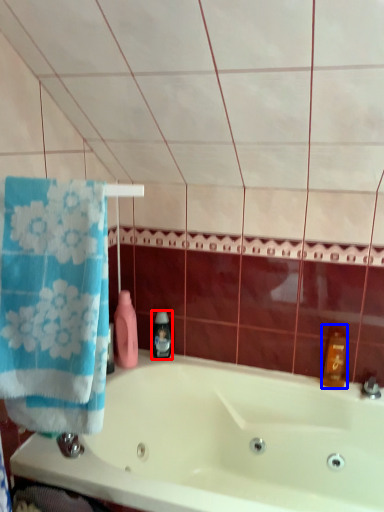
Question: Which object is closer to the camera taking this photo, soap dispenser (highlighted by a red box) or cleaning product (highlighted by a blue box)?

Choices:
 (A) soap dispenser
 (B) cleaning product

Answer: (B)